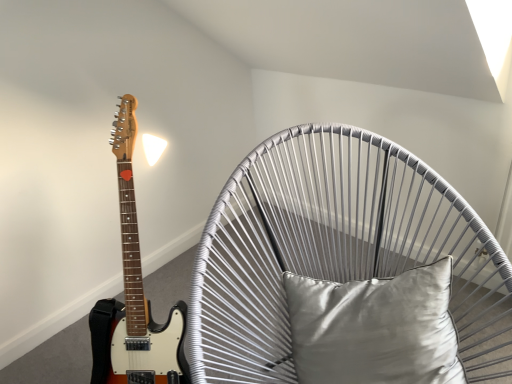
Question: Can you confirm if metallic wire swivel chair at center is shorter than satin gray pillow at center?

Choices:
 (A) no
 (B) yes

Answer: (A)

Question: Is satin gray pillow at center inside metallic wire swivel chair at center?

Choices:
 (A) no
 (B) yes

Answer: (B)

Question: Is metallic wire swivel chair at center beside satin gray pillow at center?

Choices:
 (A) no
 (B) yes

Answer: (A)

Question: Does metallic wire swivel chair at center have a lesser width compared to satin gray pillow at center?

Choices:
 (A) yes
 (B) no

Answer: (B)

Question: Could you tell me if metallic wire swivel chair at center is turned towards satin gray pillow at center?

Choices:
 (A) no
 (B) yes

Answer: (B)

Question: Considering the relative sizes of metallic wire swivel chair at center and satin gray pillow at center in the image provided, is metallic wire swivel chair at center wider than satin gray pillow at center?

Choices:
 (A) yes
 (B) no

Answer: (A)

Question: Is satin gray pillow at center in front of metallic wire swivel chair at center?

Choices:
 (A) no
 (B) yes

Answer: (A)

Question: From the image's perspective, is satin gray pillow at center above metallic wire swivel chair at center?

Choices:
 (A) no
 (B) yes

Answer: (B)

Question: Is satin gray pillow at center thinner than metallic wire swivel chair at center?

Choices:
 (A) no
 (B) yes

Answer: (B)

Question: Can you confirm if satin gray pillow at center is bigger than metallic wire swivel chair at center?

Choices:
 (A) no
 (B) yes

Answer: (A)

Question: From a real-world perspective, is satin gray pillow at center beneath metallic wire swivel chair at center?

Choices:
 (A) no
 (B) yes

Answer: (A)

Question: Is satin gray pillow at center completely or partially outside of metallic wire swivel chair at center?

Choices:
 (A) yes
 (B) no

Answer: (B)

Question: In terms of width, does satin gray pillow at center look wider or thinner when compared to metallic wire swivel chair at center?

Choices:
 (A) thin
 (B) wide

Answer: (A)